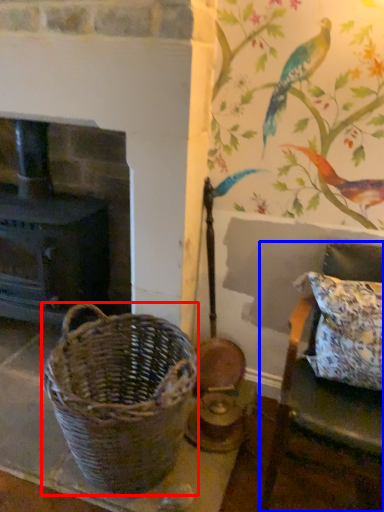
Question: Which object is further to the camera taking this photo, picnic basket (highlighted by a red box) or furniture (highlighted by a blue box)?

Choices:
 (A) picnic basket
 (B) furniture

Answer: (A)